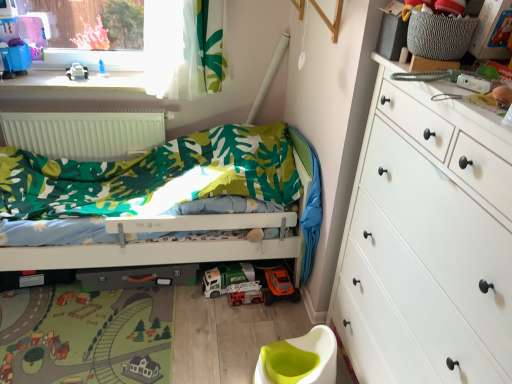
Question: Is point (99, 134) closer or farther from the camera than point (489, 148)?

Choices:
 (A) closer
 (B) farther

Answer: (B)

Question: From a real-world perspective, is white matte radiator at upper left physically located above or below white matte chest of drawers at right?

Choices:
 (A) above
 (B) below

Answer: (B)

Question: Which is nearer to the white plastic toy car at lower center, which ranks as the first toy car in top-to-bottom order?

Choices:
 (A) white matte radiator at upper left
 (B) metallic silver fire truck at center, which is the 1th toy car in bottom-to-top order
 (C) orange matte toy car at lower center
 (D) white matte chest of drawers at right
 (E) white plastic toy car at upper left

Answer: (B)

Question: Which of these objects is positioned farthest from the white matte radiator at upper left?

Choices:
 (A) orange matte toy car at lower center
 (B) matte green fabric bed at center
 (C) white plastic toy car at lower center, which ranks as the first toy car in top-to-bottom order
 (D) white matte chest of drawers at right
 (E) metallic silver fire truck at center, which is the 1th toy car in bottom-to-top order

Answer: (D)